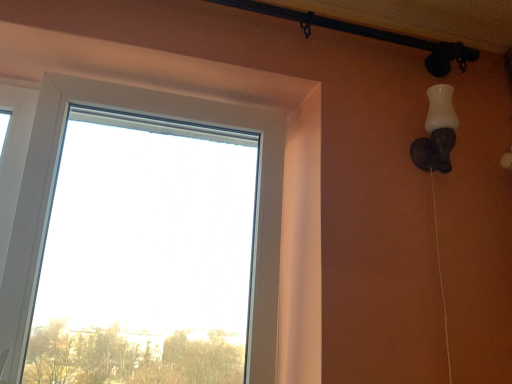
Question: Relative to transparent glass window at center, is white matte lamp at upper right in front or behind?

Choices:
 (A) front
 (B) behind

Answer: (B)

Question: In terms of size, does white matte lamp at upper right appear bigger or smaller than transparent glass window at center?

Choices:
 (A) small
 (B) big

Answer: (A)

Question: Does point (445, 132) appear closer or farther from the camera than point (15, 342)?

Choices:
 (A) farther
 (B) closer

Answer: (A)

Question: Relative to white matte lamp at upper right, is transparent glass window at center in front or behind?

Choices:
 (A) front
 (B) behind

Answer: (A)

Question: Is transparent glass window at center to the left or to the right of white matte lamp at upper right in the image?

Choices:
 (A) left
 (B) right

Answer: (A)

Question: Is transparent glass window at center wider or thinner than white matte lamp at upper right?

Choices:
 (A) wide
 (B) thin

Answer: (A)

Question: Considering the positions of transparent glass window at center and white matte lamp at upper right in the image, is transparent glass window at center taller or shorter than white matte lamp at upper right?

Choices:
 (A) tall
 (B) short

Answer: (A)